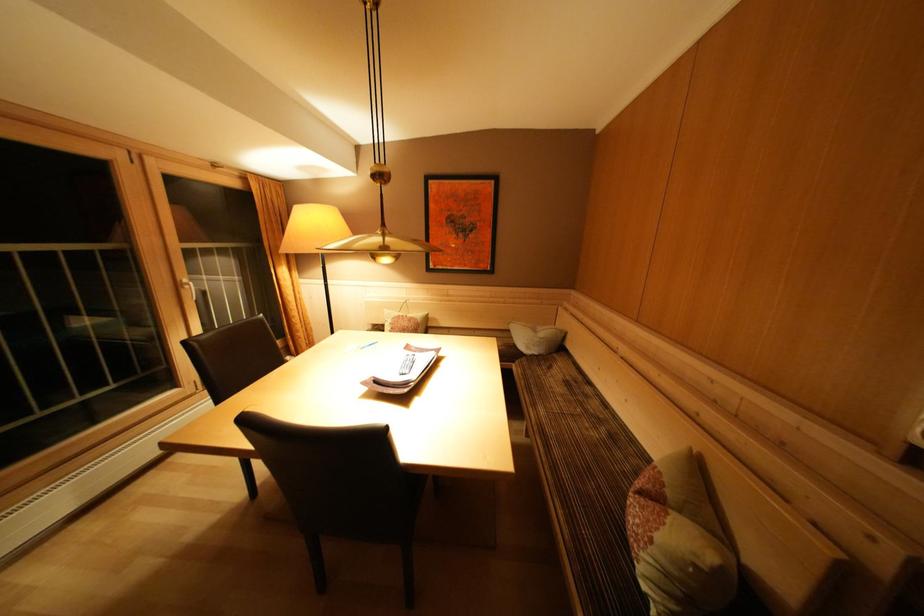
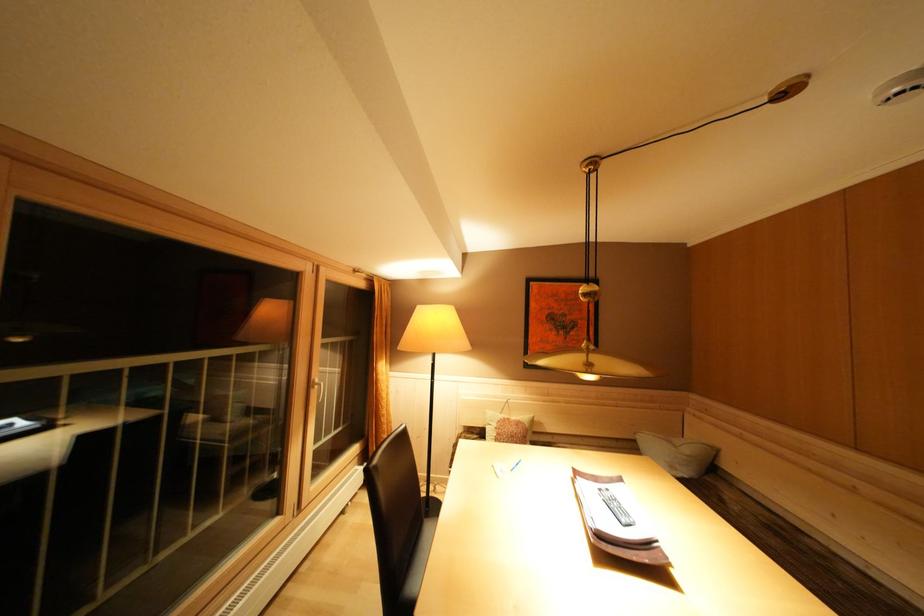
Question: In a continuous first-person perspective shot, in which direction is the camera moving?

Choices:
 (A) Left
 (B) Right
 (C) Forward
 (D) Backward

Answer: (A)